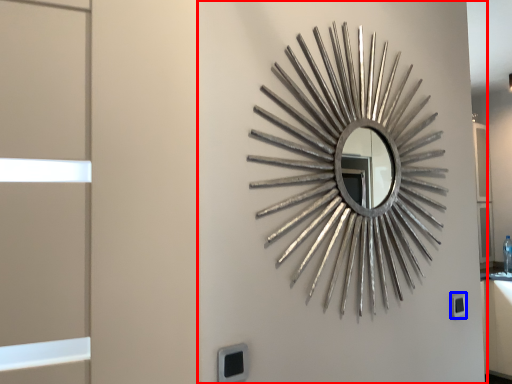
Question: Which of the following is the closest to the observer, backdrop (highlighted by a red box) or electric outlet (highlighted by a blue box)?

Choices:
 (A) backdrop
 (B) electric outlet

Answer: (A)